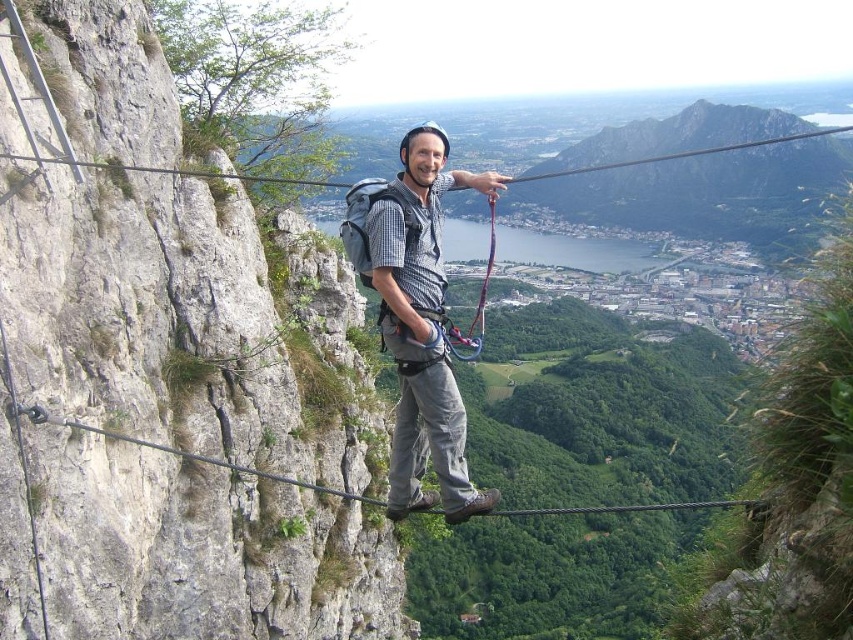
Question: Which point is closer to the camera?

Choices:
 (A) (242, 403)
 (B) (434, 132)

Answer: (B)

Question: Among these points, which one is farthest from the camera?

Choices:
 (A) (396, 467)
 (B) (26, 6)

Answer: (A)

Question: Is smooth gray rock at left smaller than matte gray helmet at center?

Choices:
 (A) yes
 (B) no

Answer: (A)

Question: Which of the following is the farthest from the observer?

Choices:
 (A) (132, 602)
 (B) (392, 310)

Answer: (B)

Question: Is smooth gray rock at left to the left of matte gray helmet at center from the viewer's perspective?

Choices:
 (A) no
 (B) yes

Answer: (B)

Question: Does smooth gray rock at left appear under matte gray helmet at center?

Choices:
 (A) yes
 (B) no

Answer: (B)